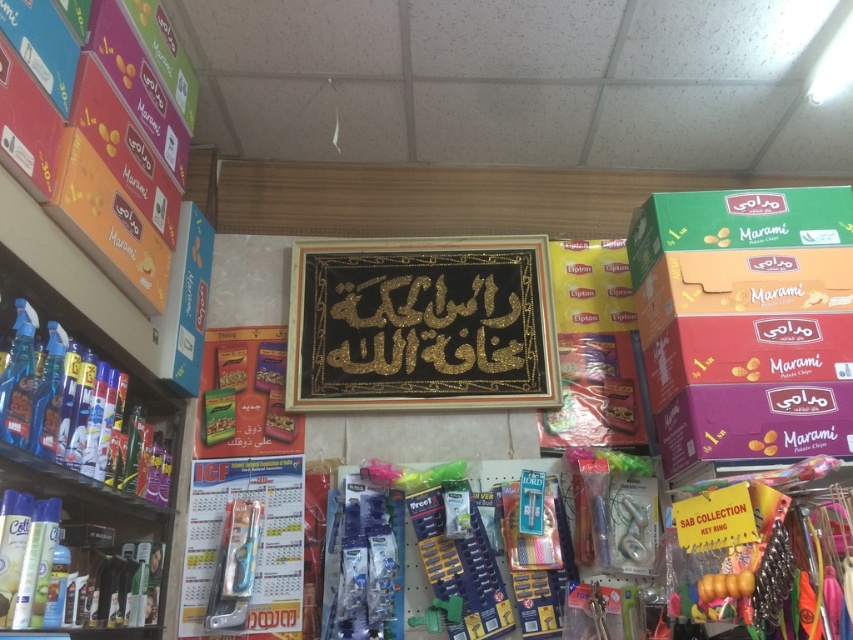
From the picture: Does orange matte box at upper left appear on the left side of shiny plastic bottles at left?

Incorrect, orange matte box at upper left is not on the left side of shiny plastic bottles at left.

Which of these two, orange matte box at upper left or shiny plastic bottles at left, stands taller?

shiny plastic bottles at left is taller.

Describe the element at coordinates (115, 180) in the screenshot. The image size is (853, 640). I see `orange matte box at upper left` at that location.

Where is `orange matte box at upper left`? This screenshot has height=640, width=853. orange matte box at upper left is located at coordinates click(x=115, y=180).

Is point (788, 324) positioned behind point (392, 278)?

That is False.

Between point (695, 328) and point (289, 352), which one is positioned in front?

Point (695, 328) is more forward.

Identify the location of green matte box at right. This screenshot has width=853, height=640. (746, 321).

Identify the location of green matte box at right. (746, 321).

Between point (518, 356) and point (91, 196), which one is positioned behind?

Point (518, 356)

Between point (378, 308) and point (108, 166), which one is positioned behind?

Positioned behind is point (378, 308).

Where is `gold glitter calligraphy at center`? The image size is (853, 640). gold glitter calligraphy at center is located at coordinates (421, 324).